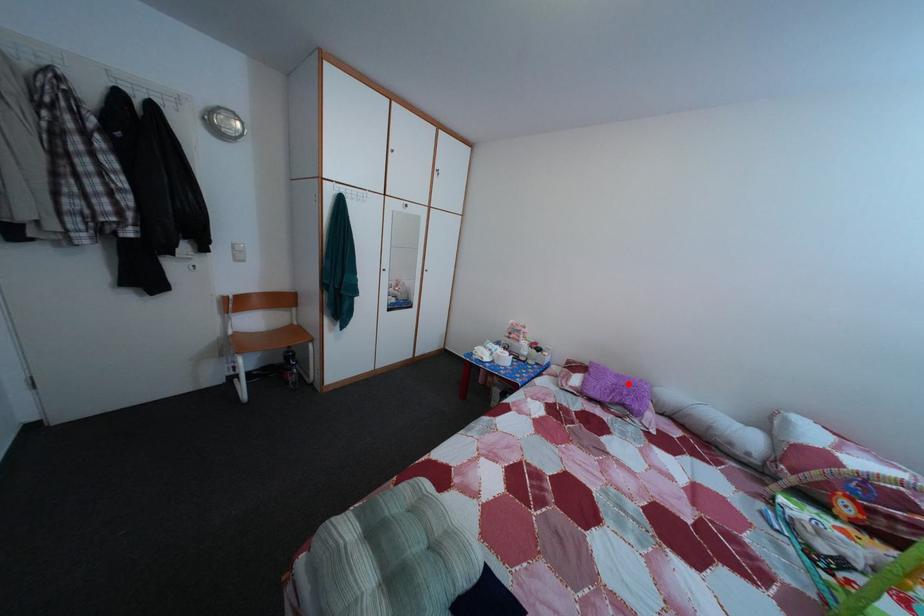
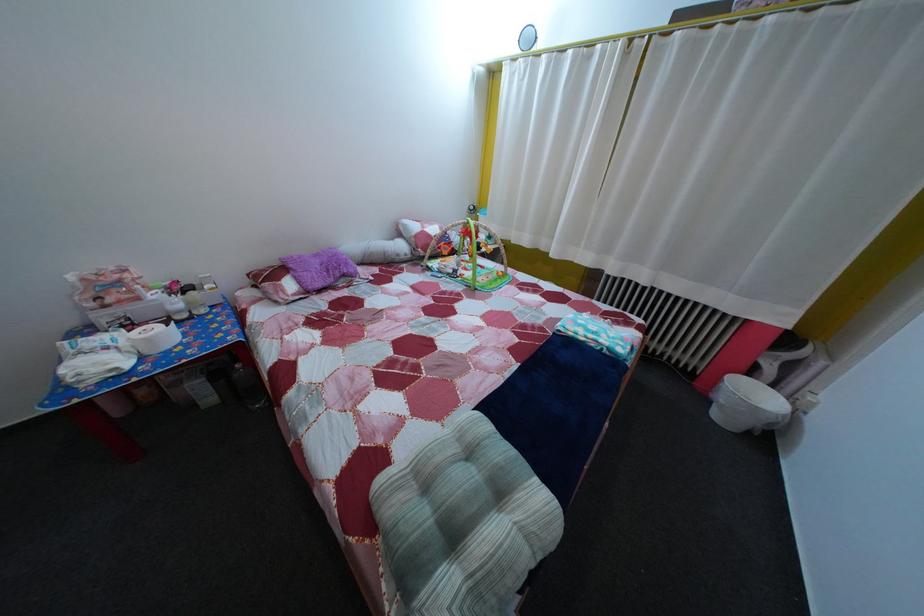
Question: I am providing you with two images of the same scene from different viewpoints. In image1, a red point is highlighted. Considering the same 3D point in image2, which of the following is correct?

Choices:
 (A) It is closer
 (B) It is farther

Answer: (A)